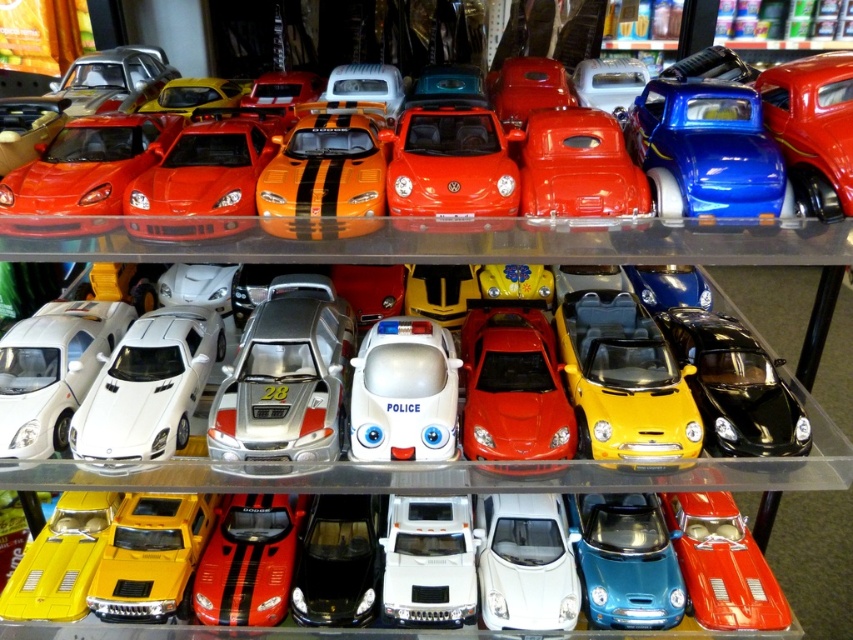
Does yellow matte car at center have a smaller size compared to shiny red car at center?

→ Yes.

Who is more distant from viewer, (676, 372) or (753, 550)?

Positioned behind is point (753, 550).

Locate an element on the screen. yellow matte car at center is located at coordinates (624, 380).

Looking at this image, is yellow matte car at center to the left of white plastic truck at center from the viewer's perspective?

Incorrect, yellow matte car at center is not on the left side of white plastic truck at center.

Can you confirm if yellow matte car at center is positioned below white plastic truck at center?

Actually, yellow matte car at center is above white plastic truck at center.

I want to click on yellow matte car at center, so click(x=624, y=380).

Looking at this image, is shiny red car at center further to camera compared to white plastic truck at center?

No, it is not.

Consider the image. Does shiny red car at center have a greater height compared to white plastic truck at center?

Indeed, shiny red car at center has a greater height compared to white plastic truck at center.

Is point (717, 545) positioned before point (448, 531)?

No, it is not.

What are the coordinates of `shiny red car at center` in the screenshot? It's located at (722, 563).